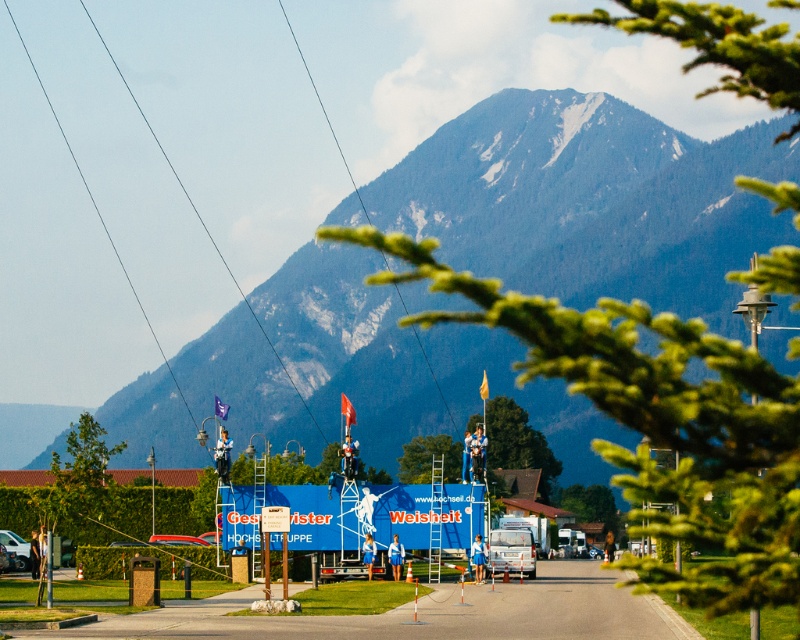
Does green forested mountain at upper center come behind metallic silver car at center?

Yes, green forested mountain at upper center is behind metallic silver car at center.

Between point (590, 472) and point (20, 566), which one is positioned in front?

Point (20, 566)

Where is `green forested mountain at upper center`? The width and height of the screenshot is (800, 640). green forested mountain at upper center is located at coordinates (590, 202).